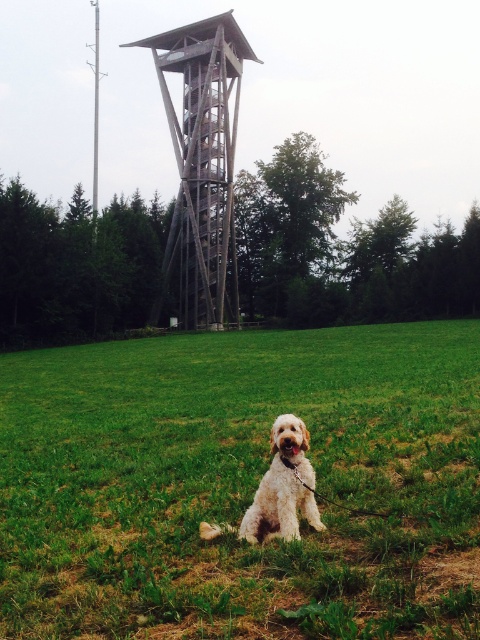
You are standing in the field and want to take a photo of the golden fur dog at center. Since the green grass at center is under the dog, will the grass be visible in the photo background?

The green grass at center is positioned under the golden fur dog at center, so the grass will be visible in the background of the photo as it is beneath the dog.

You are standing at the origin point of the coordinate system, which is at the bottom left corner of the image. You want to walk towards the wooden tower at center. In which direction should you move relative to your current position?

Since the wooden tower at center is located at coordinate point 0.259 on the x axis and 0.423 on the y axis, you should move northeast to reach it. This is because the x coordinate is to the right and the y coordinate is upwards from the origin at the bottom left corner.